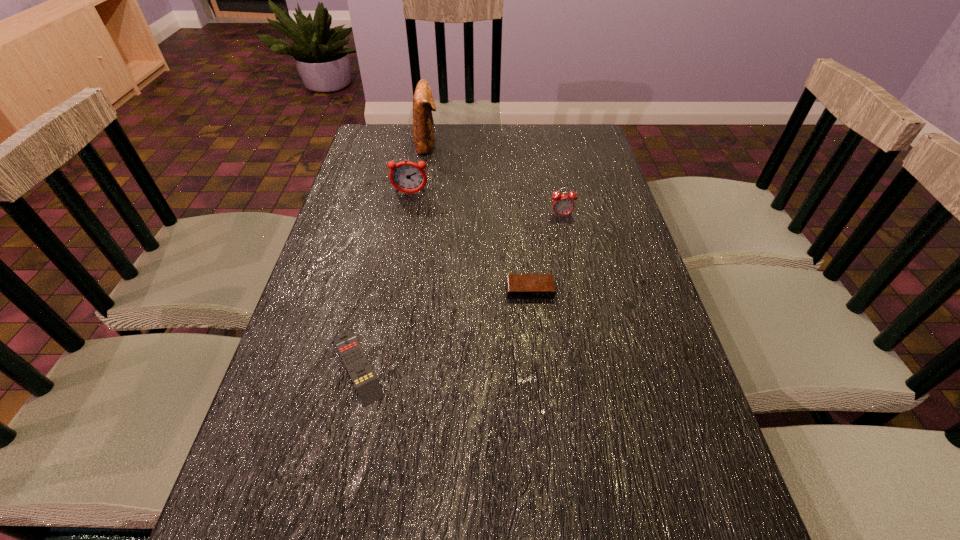
The height and width of the screenshot is (540, 960). Identify the location of vacant space at the right edge. (609, 367).

Find the location of a particular element. Image resolution: width=960 pixels, height=540 pixels. vacant position at the far left corner of the desktop is located at coordinates (374, 127).

At what (x,y) coordinates should I click in order to perform the action: click on empty space that is in between the second nearest object and the farthest object. Please return your answer as a coordinate pair (x, y). Image resolution: width=960 pixels, height=540 pixels. Looking at the image, I should click on pos(479,217).

At what (x,y) coordinates should I click in order to perform the action: click on free space between the second farthest object and the second alarm clock from right to left. Please return your answer as a coordinate pair (x, y). Looking at the image, I should click on (470, 242).

Find the location of `vacant region between the clutch bag and the second tallest alarm clock`. vacant region between the clutch bag and the second tallest alarm clock is located at coordinates (494, 180).

Identify the location of empty space between the leftmost alarm clock and the rightmost object. This screenshot has width=960, height=540. (486, 205).

What are the coordinates of `free spot between the clutch bag and the second alarm clock from right to left` in the screenshot? It's located at (479, 217).

At what (x,y) coordinates should I click in order to perform the action: click on free point between the nearest object and the clutch bag. Please return your answer as a coordinate pair (x, y). The width and height of the screenshot is (960, 540). Looking at the image, I should click on (393, 255).

Identify the location of free point between the second farthest alarm clock and the remote control. Image resolution: width=960 pixels, height=540 pixels. (460, 291).

Locate an element on the screen. This screenshot has width=960, height=540. free space between the remote control and the tallest alarm clock is located at coordinates (384, 280).